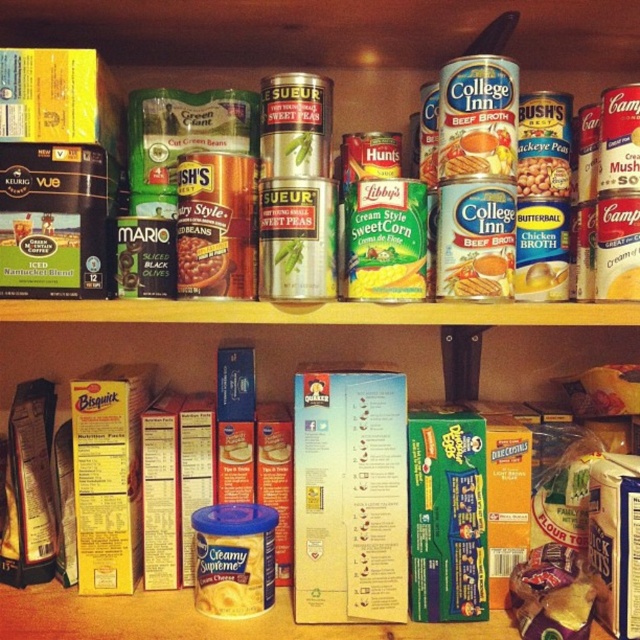
You are standing in front of the pantry shelf and need to reach two points marked in the image. Which point, point (212, 268) or point (548, 170), is closer to you?

Point (212, 268) is closer to the viewer than point (548, 170).

You are organizing the pantry and need to place a new item between the matte gold can at center right and the matte yellow can at right. Based on their positions, where should you place the new item?

The new item should be placed between the matte gold can at center right and the matte yellow can at right, as the matte gold can at center right is to the left of the matte yellow can at right.

In the scene shown: You are organizing a pantry and need to place a 12 inch long object between the matte black olives at center and the matte yellow can at right. Can you fit it there?

The distance between the matte black olives at center and the matte yellow can at right is 15.03 inches. Since the object is 12 inches long, it can fit in the space between them.